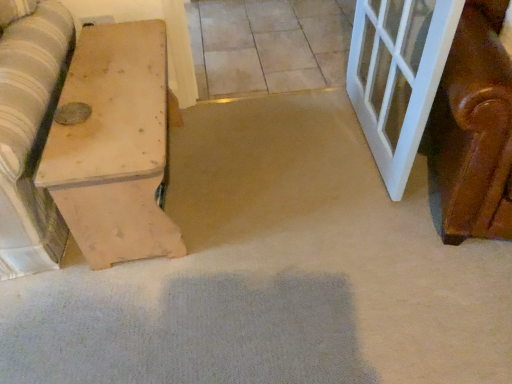
Find the location of `free spot to the right of light brown wood chest at left`. free spot to the right of light brown wood chest at left is located at coordinates (273, 193).